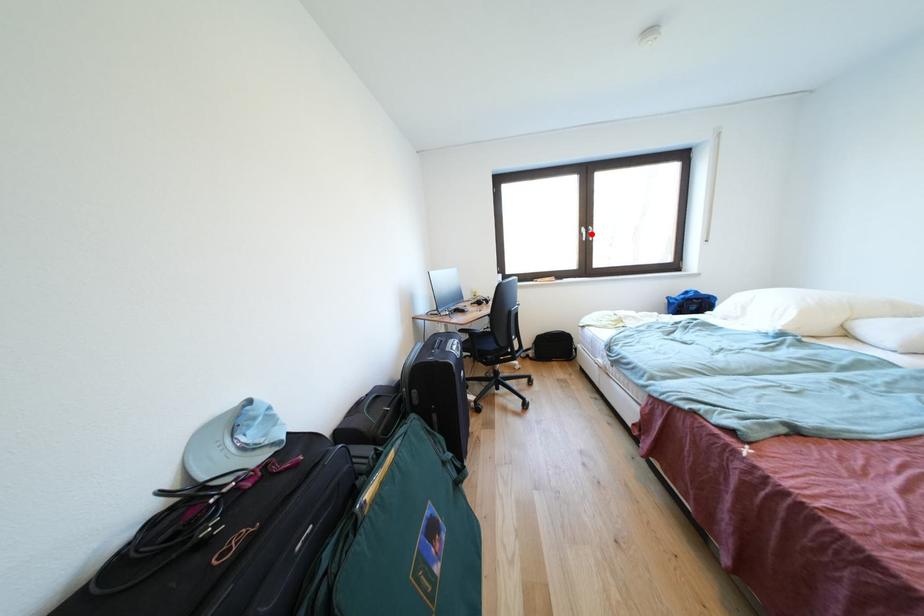
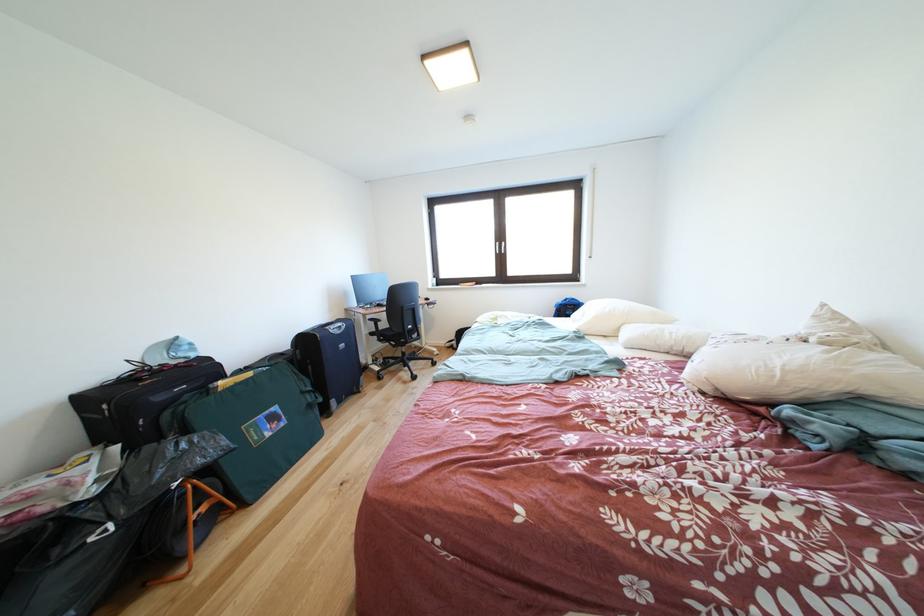
Question: A red point is marked in image1. In image2, is the corresponding 3D point closer to the camera or farther? Reply with the corresponding letter.

Choices:
 (A) The corresponding 3D point is closer.
 (B) The corresponding 3D point is farther.

Answer: (A)